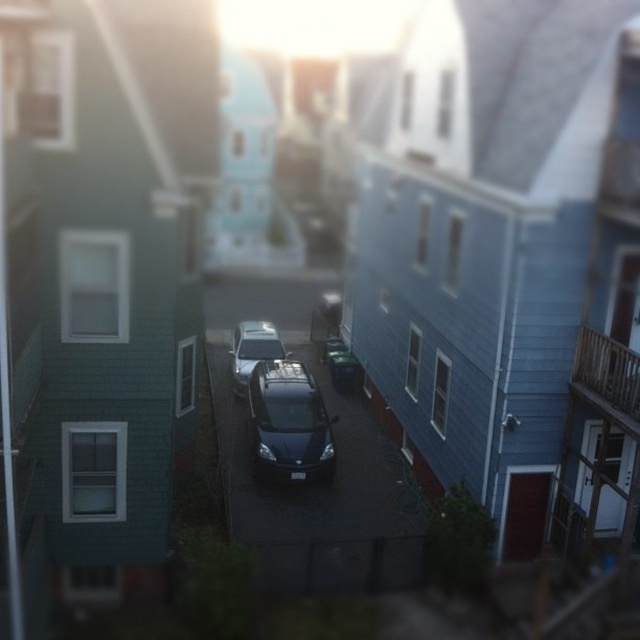
You are a delivery driver who needs to park your vehicle in this alleyway. You have two cars here, a matte black car at center and a satin silver car at center. Which car is positioned to the right side of the other?

The matte black car at center is to the right of the satin silver car at center.

From the picture: You are standing at the entrance of the alleyway between the greenish blue house and the blue gray house. There is a point marked at coordinates [289,422]. What object is located at that point?

The point at coordinates [289,422] corresponds to the matte black car at center.

You are a delivery person with a 10 feet wide truck. You need to park your truck between the matte black car at center and the satin silver car at center. Is there enough space between them for your truck?

The matte black car at center and the satin silver car at center are 12.85 feet apart. Since your truck is 10 feet wide, there is enough space between them to park your truck.